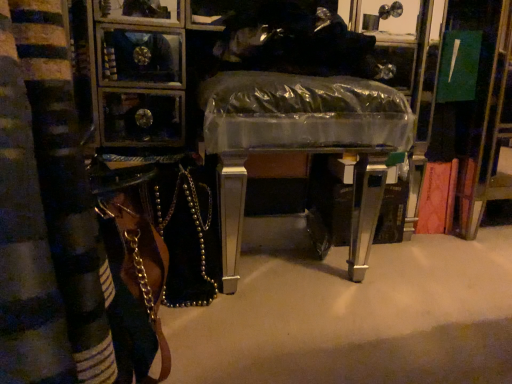
Measure the distance between clear plastic table at center and camera.

clear plastic table at center and camera are 32.76 inches apart.

Where is `clear plastic table at center`? This screenshot has width=512, height=384. clear plastic table at center is located at coordinates (302, 142).

What do you see at coordinates (302, 142) in the screenshot? The width and height of the screenshot is (512, 384). I see `clear plastic table at center` at bounding box center [302, 142].

I want to click on clear plastic table at center, so click(x=302, y=142).